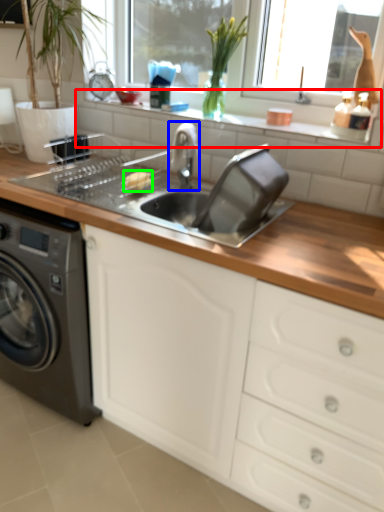
Question: Estimate the real-world distances between objects in this image. Which object is farther from window sill (highlighted by a red box), tap (highlighted by a blue box) or food (highlighted by a green box)?

Choices:
 (A) tap
 (B) food

Answer: (B)